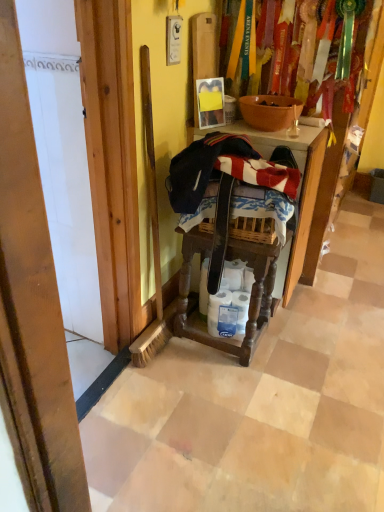
Locate an element on the screen. white matte toilet paper at center is located at coordinates (230, 302).

Looking at this image, can you confirm if wooden step stool at center is bigger than matte orange bowl at center?

Yes.

From a real-world perspective, is wooden step stool at center above or below matte orange bowl at center?

In terms of real-world spatial position, wooden step stool at center is below matte orange bowl at center.

Considering the relative positions of wooden step stool at center and matte orange bowl at center in the image provided, is wooden step stool at center to the left or to the right of matte orange bowl at center?

wooden step stool at center is to the left of matte orange bowl at center.

From the image's perspective, is wooden step stool at center positioned above or below white matte toilet paper at center?

Based on their image positions, wooden step stool at center is located above white matte toilet paper at center.

Does wooden step stool at center appear on the left side of white matte toilet paper at center?

Correct, you'll find wooden step stool at center to the left of white matte toilet paper at center.

Based on their sizes in the image, would you say wooden step stool at center is bigger or smaller than white matte toilet paper at center?

wooden step stool at center is bigger than white matte toilet paper at center.

How different are the orientations of wooden step stool at center and white matte toilet paper at center in degrees?

They differ by 67.1 degrees in their facing directions.

Would you say matte orange bowl at center contains wooden step stool at center?

No, wooden step stool at center is not surrounded by matte orange bowl at center.

Are matte orange bowl at center and wooden step stool at center located far from each other?

No.

In the scene shown: Who is shorter, matte orange bowl at center or wooden step stool at center?

Standing shorter between the two is matte orange bowl at center.

Between point (296, 106) and point (239, 345), which one is positioned behind?

Point (296, 106)

Do you think matte orange bowl at center is within white matte toilet paper at center, or outside of it?

matte orange bowl at center exists outside the volume of white matte toilet paper at center.

Could you tell me if matte orange bowl at center is facing white matte toilet paper at center?

No, matte orange bowl at center is not turned towards white matte toilet paper at center.

From a real-world perspective, is matte orange bowl at center physically above white matte toilet paper at center?

Correct, in the physical world, matte orange bowl at center is higher than white matte toilet paper at center.

Is white matte toilet paper at center to the left of wooden step stool at center from the viewer's perspective?

Incorrect, white matte toilet paper at center is not on the left side of wooden step stool at center.

Is white matte toilet paper at center facing away from wooden step stool at center?

Yes, white matte toilet paper at center is facing away from wooden step stool at center.

Would you say white matte toilet paper at center is a long distance from wooden step stool at center?

They are positioned close to each other.

Is white matte toilet paper at center positioned in front of matte orange bowl at center?

No.

From the image's perspective, between white matte toilet paper at center and matte orange bowl at center, who is located below?

white matte toilet paper at center appears lower in the image.

Could you tell me if white matte toilet paper at center is facing matte orange bowl at center?

No, white matte toilet paper at center is not facing towards matte orange bowl at center.

This screenshot has height=512, width=384. I want to click on step stool lying in front of the matte orange bowl at center, so click(251, 292).

This screenshot has height=512, width=384. I want to click on toilet paper below the wooden step stool at center (from the image's perspective), so click(x=230, y=302).

From the image, which object appears to be nearer to white matte toilet paper at center, wooden step stool at center or matte orange bowl at center?

wooden step stool at center lies closer to white matte toilet paper at center than the other object.

Looking at the image, which one is located further to wooden step stool at center, white matte toilet paper at center or matte orange bowl at center?

matte orange bowl at center lies further to wooden step stool at center than the other object.

Which object lies further to the anchor point white matte toilet paper at center, matte orange bowl at center or wooden step stool at center?

Based on the image, matte orange bowl at center appears to be further to white matte toilet paper at center.

Based on their spatial positions, is matte orange bowl at center or white matte toilet paper at center closer to wooden step stool at center?

white matte toilet paper at center is positioned closer to the anchor wooden step stool at center.

Looking at the image, which one is located further to matte orange bowl at center, white matte toilet paper at center or wooden step stool at center?

white matte toilet paper at center is further to matte orange bowl at center.

Considering their positions, is wooden step stool at center positioned closer to matte orange bowl at center than white matte toilet paper at center?

wooden step stool at center.

Locate an element on the screen. The height and width of the screenshot is (512, 384). step stool between matte orange bowl at center and white matte toilet paper at center from top to bottom is located at coordinates (251, 292).